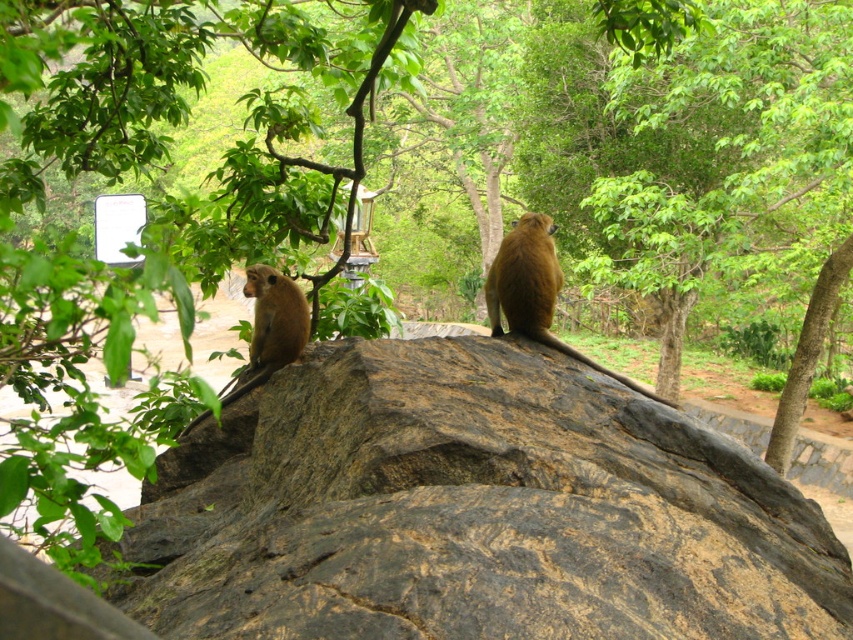
You are a photographer trying to capture both the brown rough rock at center and the golden fur monkey at center in a single frame. Based on their sizes, which object should you focus on first to ensure both fit in the shot?

The brown rough rock at center is wider than the golden fur monkey at center, so you should focus on the brown rough rock at center first to ensure both fit in the shot.

You are a geologist studying rock formations. You observe the brown rough rock at center in the image. Based on its position, can you determine if it is closer to the camera or further away compared to the background greenery?

The brown rough rock at center is located at point coordinates that place it in the central area of the image. Since the background greenery is described as being behind the rock, the rock is closer to the camera than the background greenery.

You are a photographer trying to capture a clear shot of both the brown rough rock at center and the golden fur monkey at center. Since you want to ensure both are in focus, you need to know which one is taller. Can you determine which object is taller?

The brown rough rock at center has a greater height compared to the golden fur monkey at center, so the brown rough rock at center is taller.